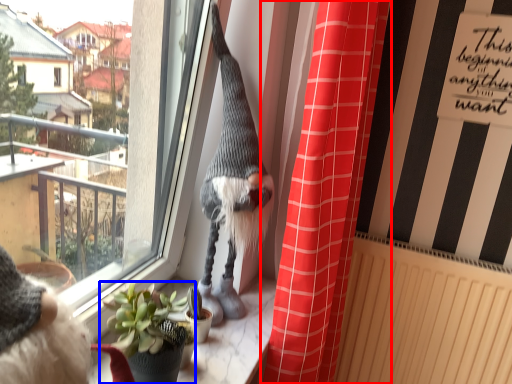
Question: Which of the following is the closest to the observer, curtain (highlighted by a red box) or houseplant (highlighted by a blue box)?

Choices:
 (A) curtain
 (B) houseplant

Answer: (B)